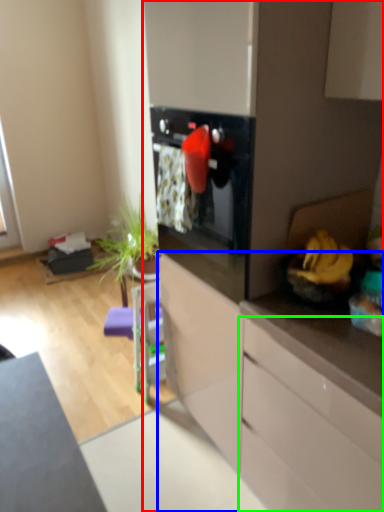
Question: Based on their relative distances, which object is farther from dresser (highlighted by a red box)? Choose from cabinetry (highlighted by a blue box) and cabinetry (highlighted by a green box).

Choices:
 (A) cabinetry
 (B) cabinetry

Answer: (B)